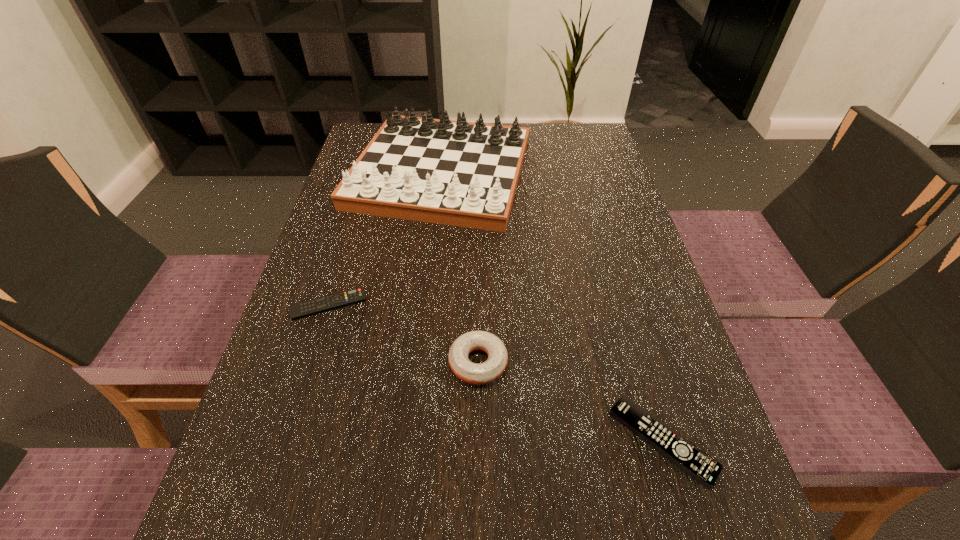
Point out which object is positioned as the nearest to the left remote control. Please provide its 2D coordinates. Your answer should be formatted as a tuple, i.e. [(x, y)], where the tuple contains the x and y coordinates of a point satisfying the conditions above.

[(458, 173)]

This screenshot has height=540, width=960. What are the coordinates of `free spot that satisfies the following two spatial constraints: 1. on the back side of the gameboard; 2. on the left side of the second farthest object` in the screenshot? It's located at (370, 173).

At what (x,y) coordinates should I click in order to perform the action: click on vacant space that satisfies the following two spatial constraints: 1. on the front side of the second tallest object; 2. on the right side of the gameboard. Please return your answer as a coordinate pair (x, y). This screenshot has width=960, height=540. Looking at the image, I should click on (420, 362).

Locate an element on the screen. The width and height of the screenshot is (960, 540). free space in the image that satisfies the following two spatial constraints: 1. on the front side of the tallest object; 2. on the right side of the third shortest object is located at coordinates (420, 362).